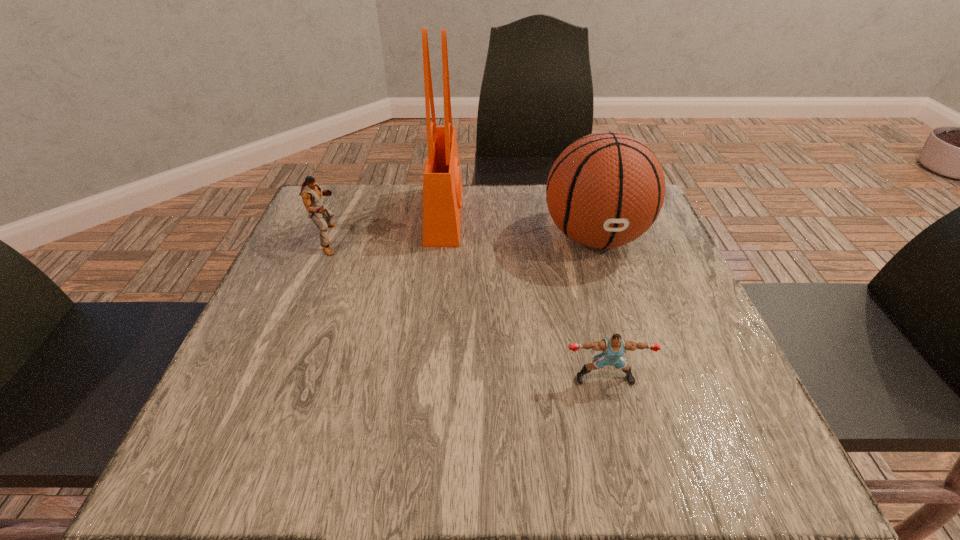
I want to click on the second object from left to right, so click(442, 185).

Identify the location of tote bag. The width and height of the screenshot is (960, 540). (442, 185).

You are a GUI agent. You are given a task and a screenshot of the screen. Output one action in this format:
    pyautogui.click(x=<x>, y=<y>)
    Task: Click on the second tallest object
    This screenshot has height=540, width=960.
    Given the screenshot: What is the action you would take?
    pyautogui.click(x=606, y=189)

In order to click on the third tallest object in this screenshot , I will do `click(311, 193)`.

Where is `the farther puncher`? the farther puncher is located at coordinates (311, 193).

Locate an element on the screen. Image resolution: width=960 pixels, height=540 pixels. the right puncher is located at coordinates (614, 347).

This screenshot has height=540, width=960. What are the coordinates of `the nearer puncher` in the screenshot? It's located at (614, 347).

Identify the location of free region located on the logo side of the second object from left to right. (582, 215).

The width and height of the screenshot is (960, 540). What are the coordinates of `free space located 0.180m on the side where the inflation valve is located` in the screenshot? It's located at (624, 335).

Locate an element on the screen. vacant space located 0.150m on the front-facing side of the left puncher is located at coordinates (405, 239).